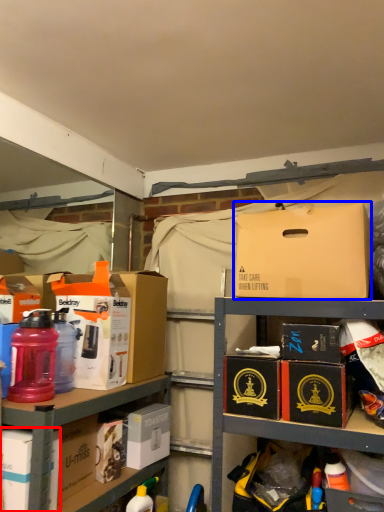
Question: Among these objects, which one is nearest to the camera, box (highlighted by a red box) or box (highlighted by a blue box)?

Choices:
 (A) box
 (B) box

Answer: (A)